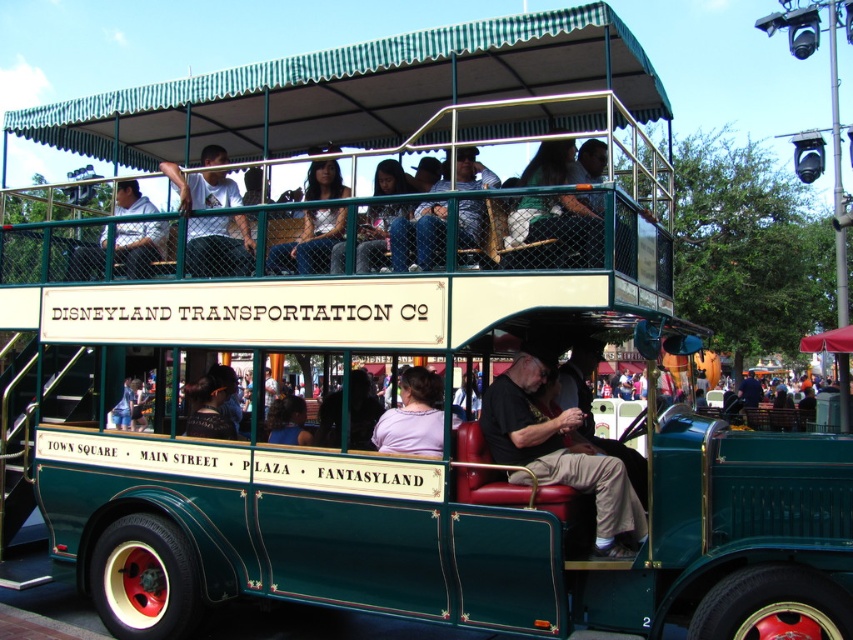
You are a guest at Disneyland and see the vintage double decker bus. You want to know if you can place your matte silver jacket at center on the leather seat at center without it touching the ceiling. Can you do that?

The leather seat at center is taller than matte silver jacket at center, so placing the matte silver jacket at center on the leather seat at center would not touch the ceiling since the seat is taller than the jacket.

You are a guest at Disneyland and want to place your matte silver jacket at center on the leather seat at center. Will the jacket fit on the seat?

The leather seat at center might be wider than matte silver jacket at center, so there is a possibility that the jacket will fit, but it is uncertain due to the comparative width.